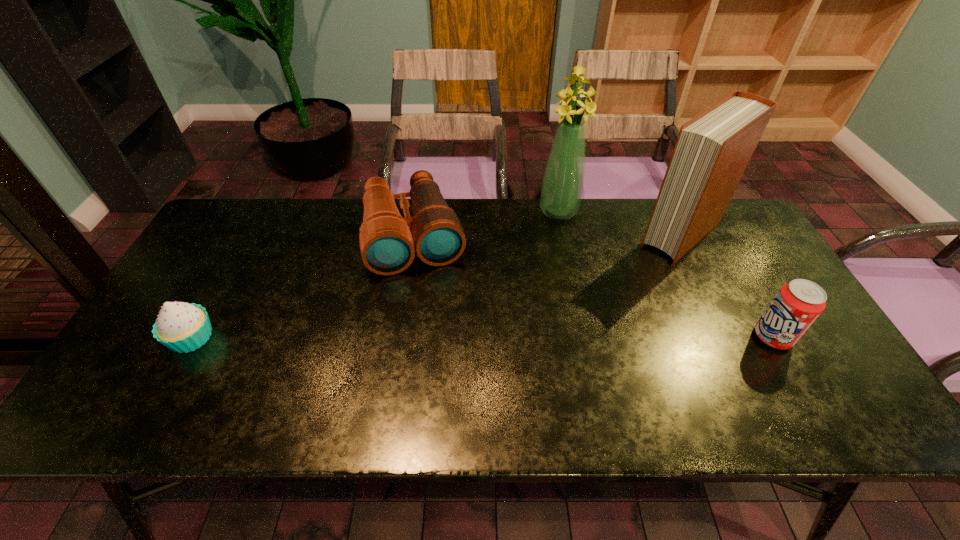
Locate an element on the screen. This screenshot has width=960, height=540. the shortest object is located at coordinates (182, 327).

Image resolution: width=960 pixels, height=540 pixels. What are the coordinates of `cupcake` in the screenshot? It's located at (182, 327).

This screenshot has height=540, width=960. Identify the location of soda can. (797, 305).

At what (x,y) coordinates should I click in order to perform the action: click on the third object from left to right. Please return your answer as a coordinate pair (x, y). This screenshot has height=540, width=960. Looking at the image, I should click on (562, 187).

Where is `hardback book`? This screenshot has width=960, height=540. hardback book is located at coordinates (713, 149).

Image resolution: width=960 pixels, height=540 pixels. I want to click on binoculars, so click(386, 244).

In order to click on vacant space located 0.120m on the right of the leftmost object in this screenshot , I will do `click(264, 338)`.

Locate an element on the screen. The height and width of the screenshot is (540, 960). vacant area located on the surface of the soda can is located at coordinates (722, 337).

Find the location of a particular element. The image size is (960, 540). vacant area situated 0.310m on the surface of the soda can is located at coordinates (631, 337).

Locate an element on the screen. Image resolution: width=960 pixels, height=540 pixels. vacant space located on the surface of the soda can is located at coordinates point(655,337).